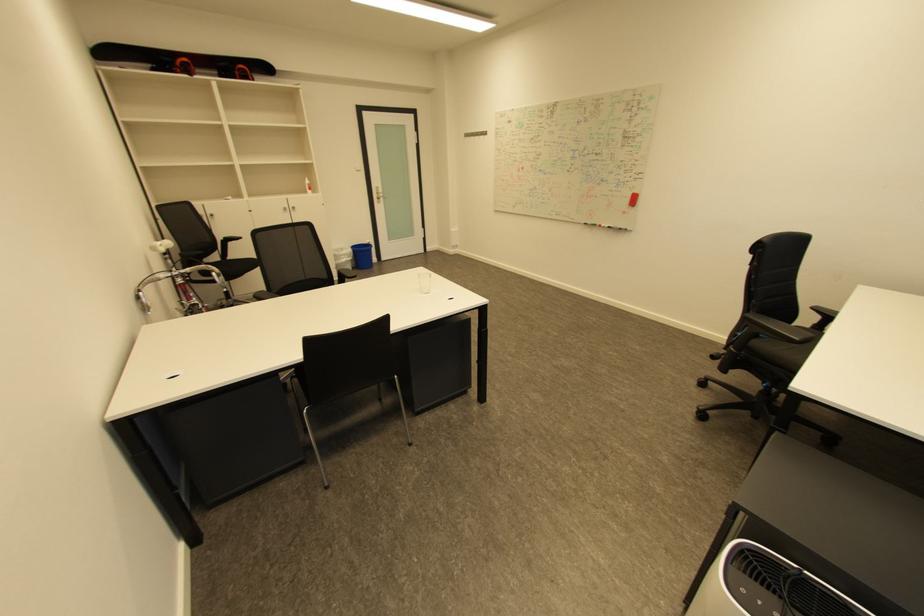
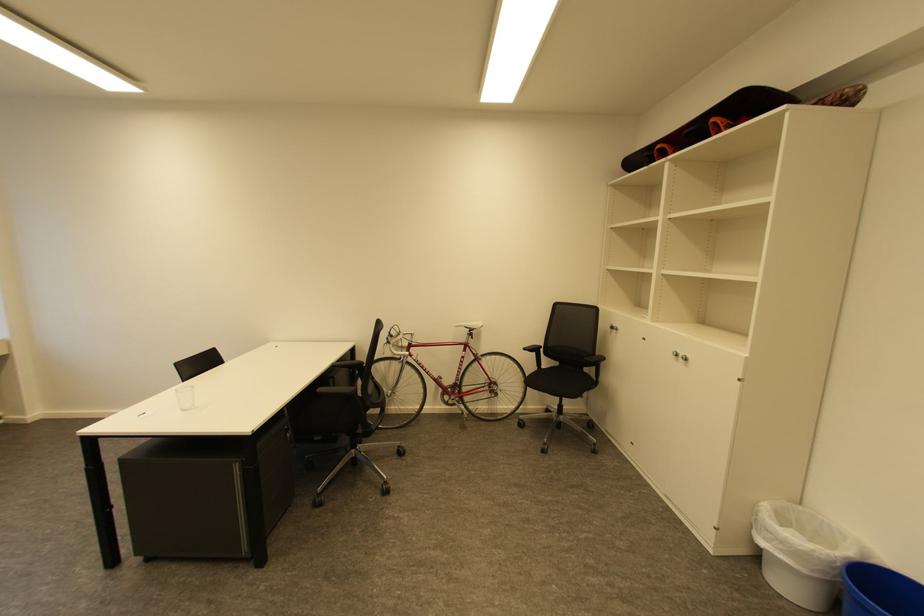
Where in the second image is the point corresponding to point (249, 66) from the first image?

(719, 120)